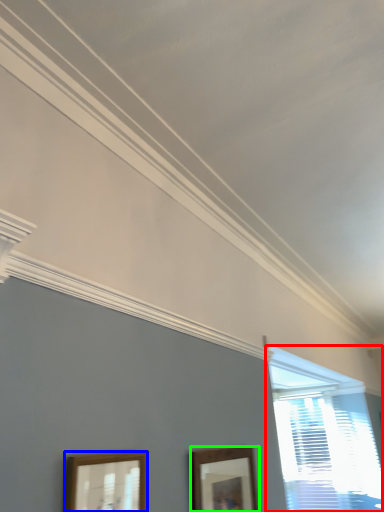
Question: Estimate the real-world distances between objects in this image. Which object is closer to window (highlighted by a red box), picture frame (highlighted by a blue box) or picture frame (highlighted by a green box)?

Choices:
 (A) picture frame
 (B) picture frame

Answer: (B)